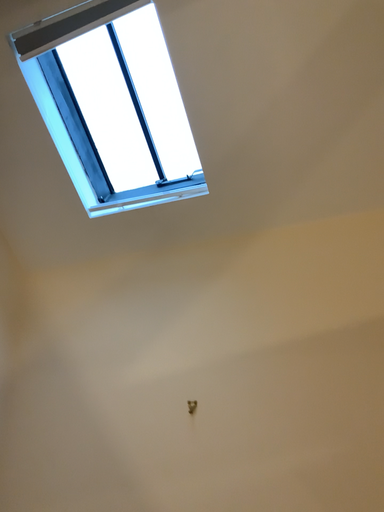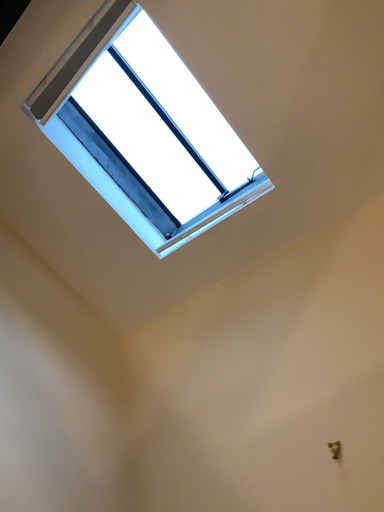
Question: Which way did the camera rotate in the video?

Choices:
 (A) rotated right
 (B) rotated left

Answer: (B)